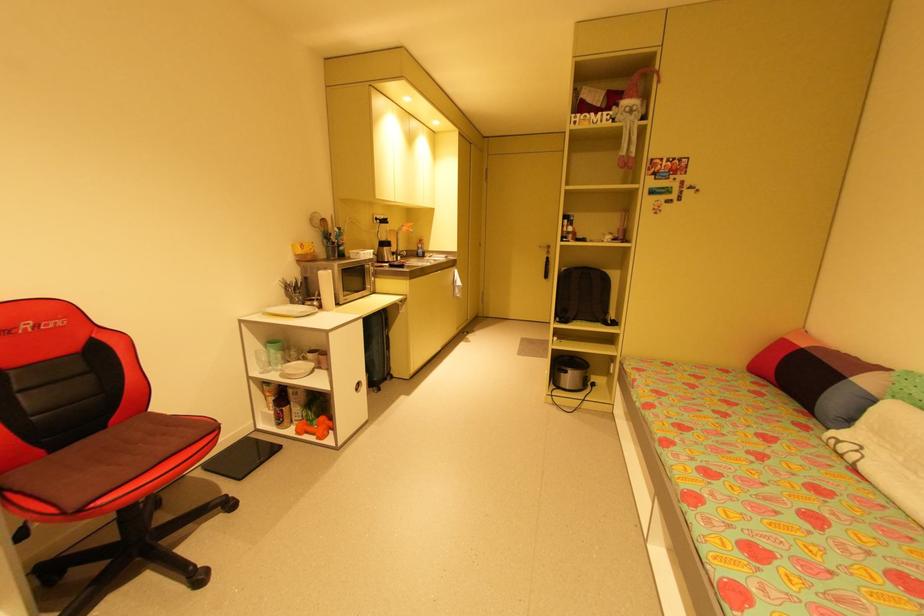
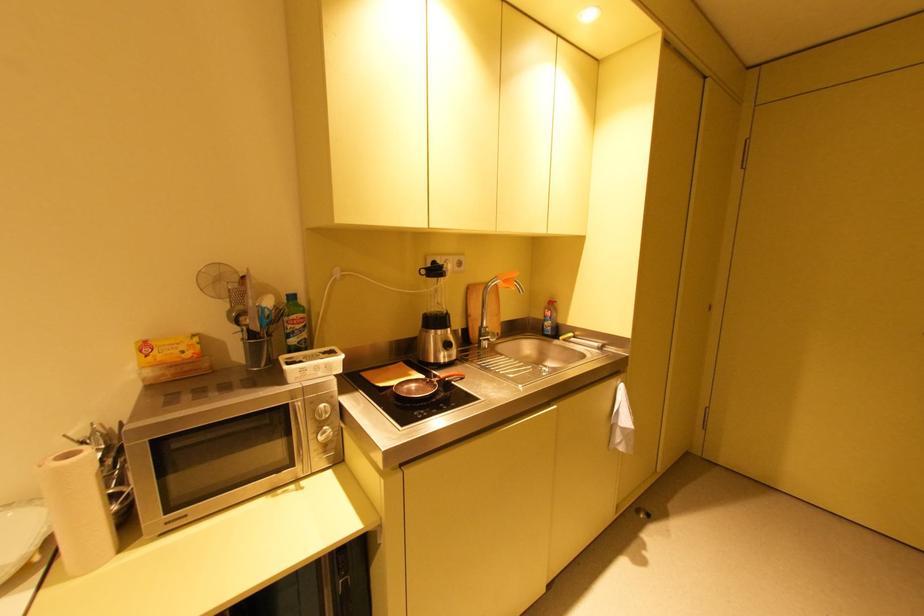
In the second image, find the point that corresponds to (x=412, y=227) in the first image.

(508, 282)